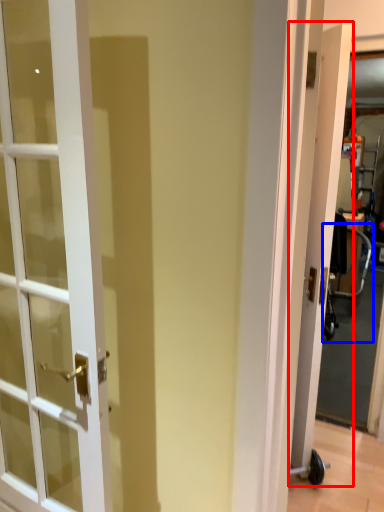
Question: Which object appears farthest to the camera in this image, door (highlighted by a red box) or baby carriage (highlighted by a blue box)?

Choices:
 (A) door
 (B) baby carriage

Answer: (B)